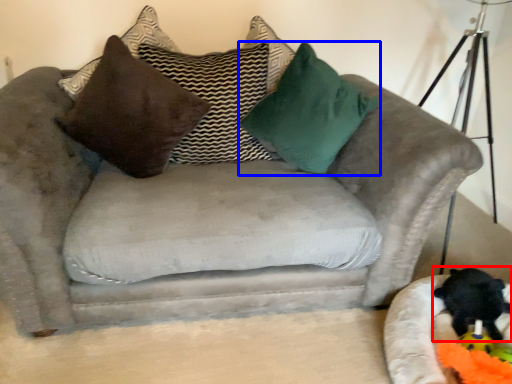
Question: Which object is closer to the camera taking this photo, animal (highlighted by a red box) or pillow (highlighted by a blue box)?

Choices:
 (A) animal
 (B) pillow

Answer: (A)